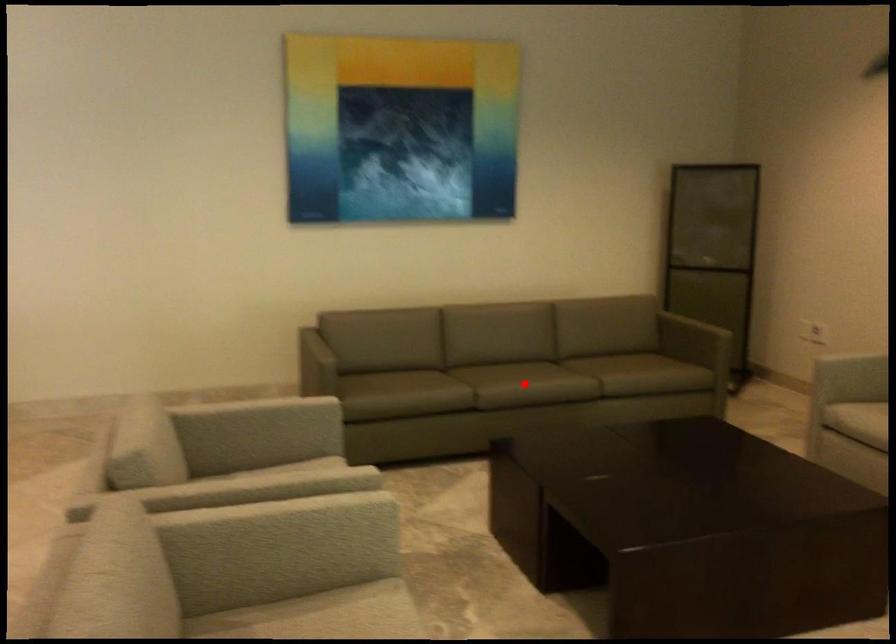
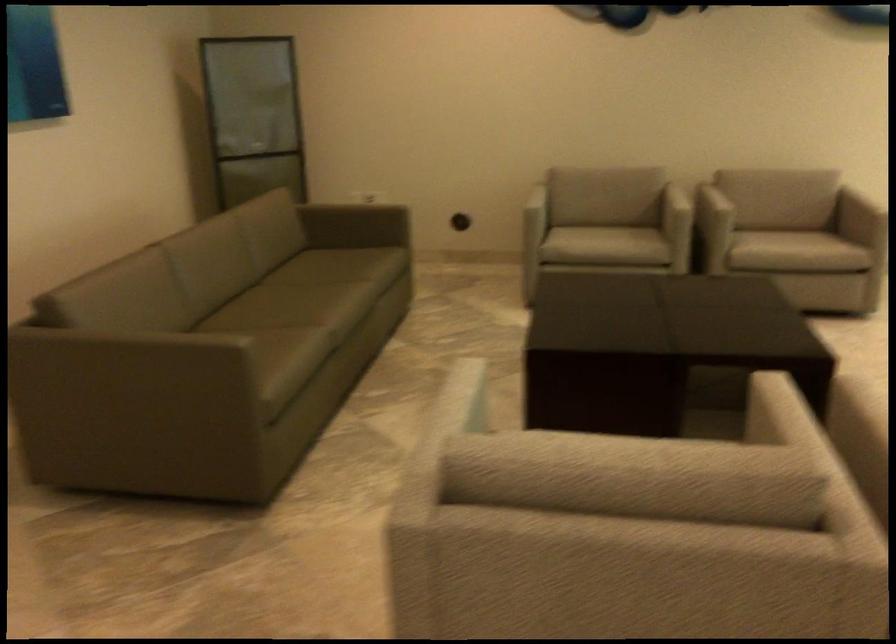
Locate, in the second image, the point that corresponds to the highlighted location in the first image.

(363, 297)